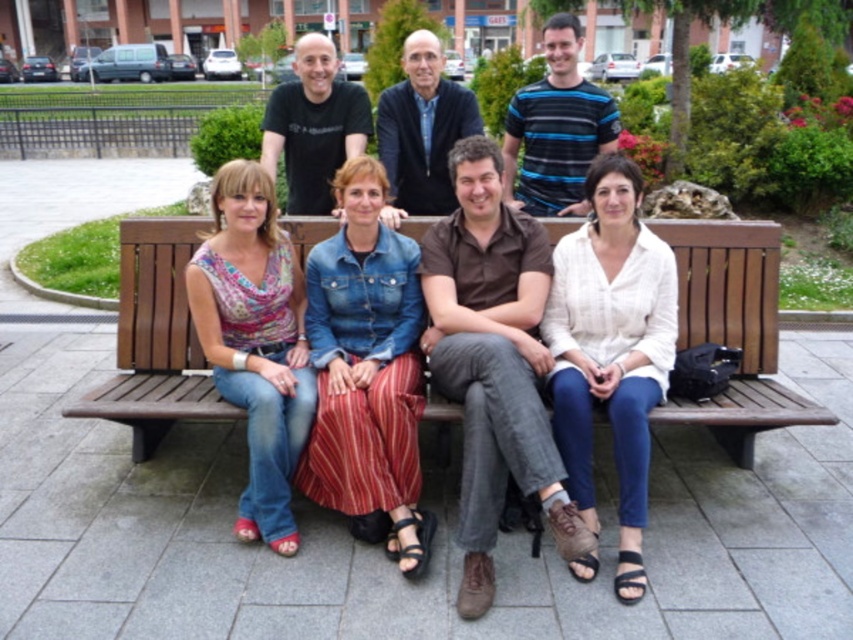
Can you confirm if denim jacket at center is thinner than wooden bench at center?

Incorrect, denim jacket at center's width is not less than wooden bench at center's.

Which is in front, point (415, 564) or point (755, 273)?

Point (415, 564)

Find the location of a particular element. denim jacket at center is located at coordinates (496, 348).

Which of these two, denim jacket at center or printed cotton blouse at left, stands shorter?

With less height is printed cotton blouse at left.

Is point (485, 214) farther from viewer compared to point (247, 304)?

That is True.

What do you see at coordinates (496, 348) in the screenshot? Image resolution: width=853 pixels, height=640 pixels. I see `denim jacket at center` at bounding box center [496, 348].

You are a GUI agent. You are given a task and a screenshot of the screen. Output one action in this format:
    pyautogui.click(x=<x>, y=<y>)
    Task: Click on the denim jacket at center
    This screenshot has width=853, height=640.
    Given the screenshot: What is the action you would take?
    pyautogui.click(x=496, y=348)

Which is below, brown cotton shirt at center or white striped shirt at center?

brown cotton shirt at center

Can you confirm if brown cotton shirt at center is taller than white striped shirt at center?

Yes, brown cotton shirt at center is taller than white striped shirt at center.

Where is `brown cotton shirt at center`? The height and width of the screenshot is (640, 853). brown cotton shirt at center is located at coordinates (492, 362).

At what (x,y) coordinates should I click in order to perform the action: click on brown cotton shirt at center. Please return your answer as a coordinate pair (x, y). Looking at the image, I should click on (492, 362).